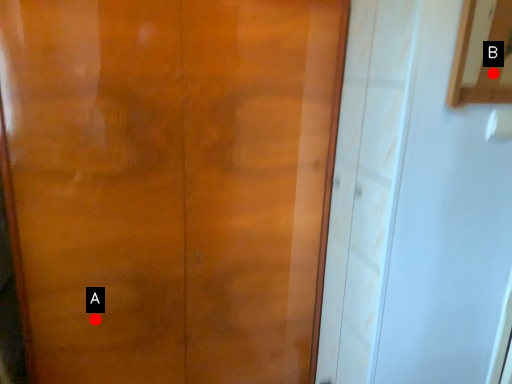
Question: Two points are circled on the image, labeled by A and B beside each circle. Which point is farther from the camera taking this photo?

Choices:
 (A) A is further
 (B) B is further

Answer: (B)